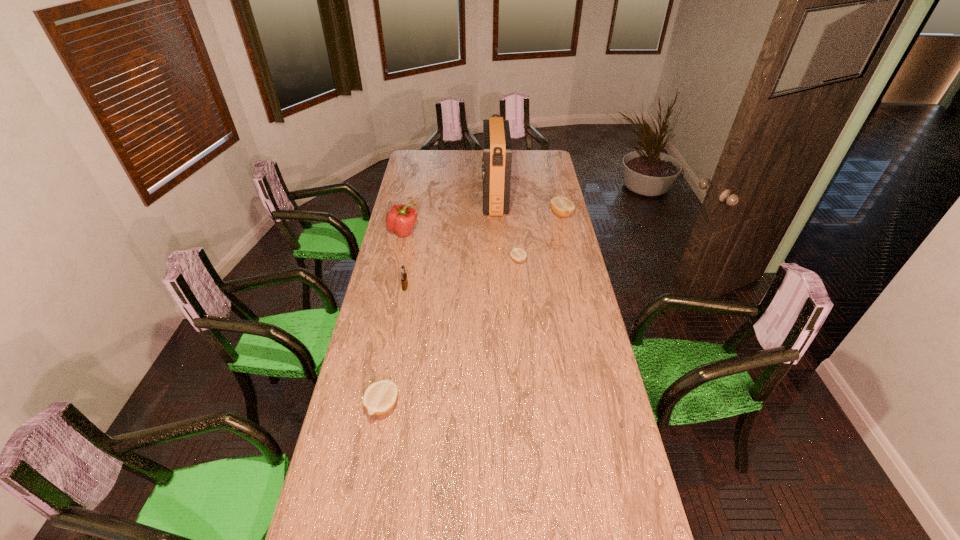
In order to click on vacant space located on the front of the nearest lemon in this screenshot , I will do `click(366, 497)`.

The height and width of the screenshot is (540, 960). In order to click on free space located 0.210m on the back of the second nearest lemon in this screenshot , I will do `click(515, 228)`.

At what (x,y) coordinates should I click in order to perform the action: click on free location located 0.260m on the left of the rightmost object. Please return your answer as a coordinate pair (x, y). Looking at the image, I should click on (500, 214).

Image resolution: width=960 pixels, height=540 pixels. Identify the location of vacant space situated 0.380m on the right of the second tallest object. (494, 232).

The image size is (960, 540). In order to click on free space located 0.140m on the front-facing side of the tallest object in this screenshot , I will do `click(457, 200)`.

This screenshot has width=960, height=540. Identify the location of vacant area situated 0.230m on the front-facing side of the tallest object. (441, 200).

Where is `vacant space located 0.060m on the front-facing side of the tallest object`? vacant space located 0.060m on the front-facing side of the tallest object is located at coordinates (471, 200).

Locate an element on the screen. This screenshot has height=540, width=960. free location located 0.160m on the right of the fifth farthest object is located at coordinates (444, 287).

Where is `lemon that is positioned at the left edge`? Image resolution: width=960 pixels, height=540 pixels. lemon that is positioned at the left edge is located at coordinates (380, 397).

What are the coordinates of `pepper that is at the left edge` in the screenshot? It's located at tap(400, 219).